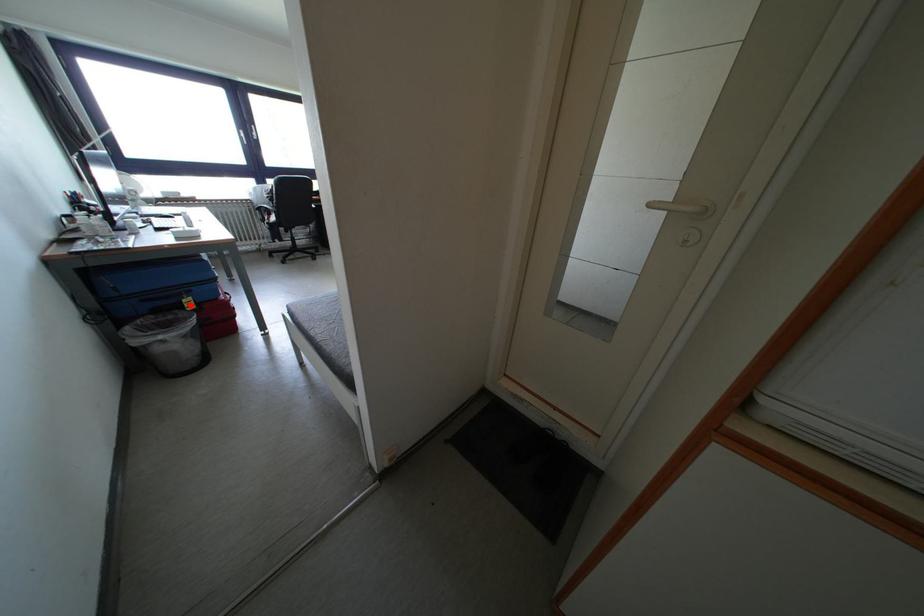
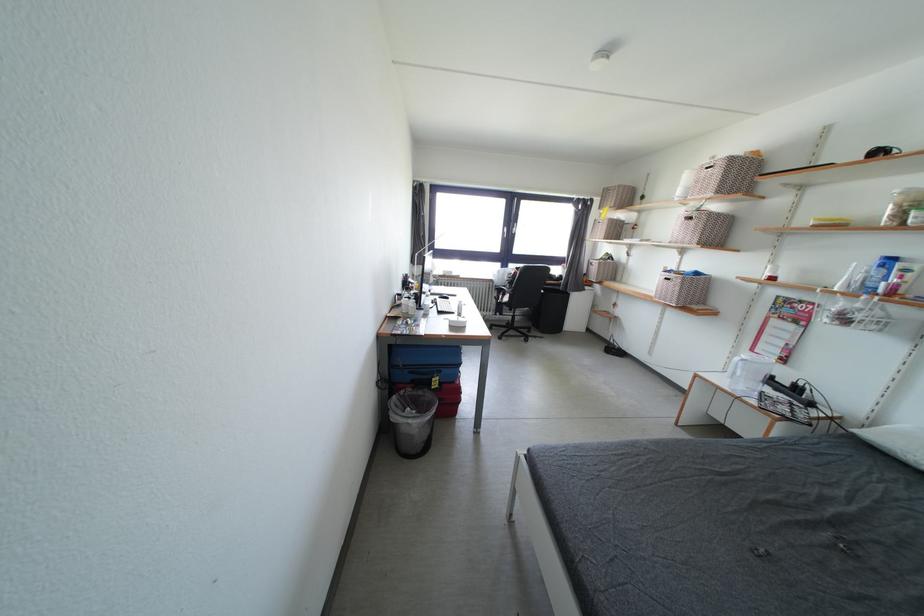
Question: I am providing you with two images of the same scene from different viewpoints. A red point is shown in image1. For the corresponding object point in image2, is it positioned nearer or farther from the camera?

Choices:
 (A) Nearer
 (B) Farther

Answer: (B)